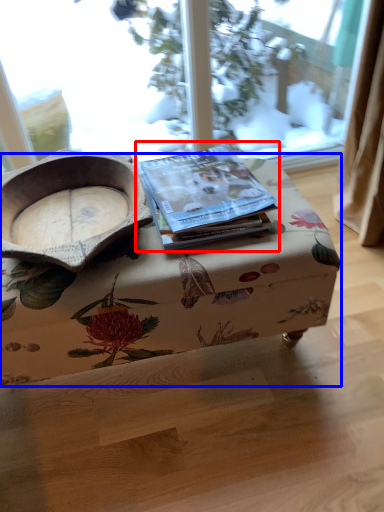
Question: Which point is closer to the camera, paperback book (highlighted by a red box) or table (highlighted by a blue box)?

Choices:
 (A) paperback book
 (B) table

Answer: (B)